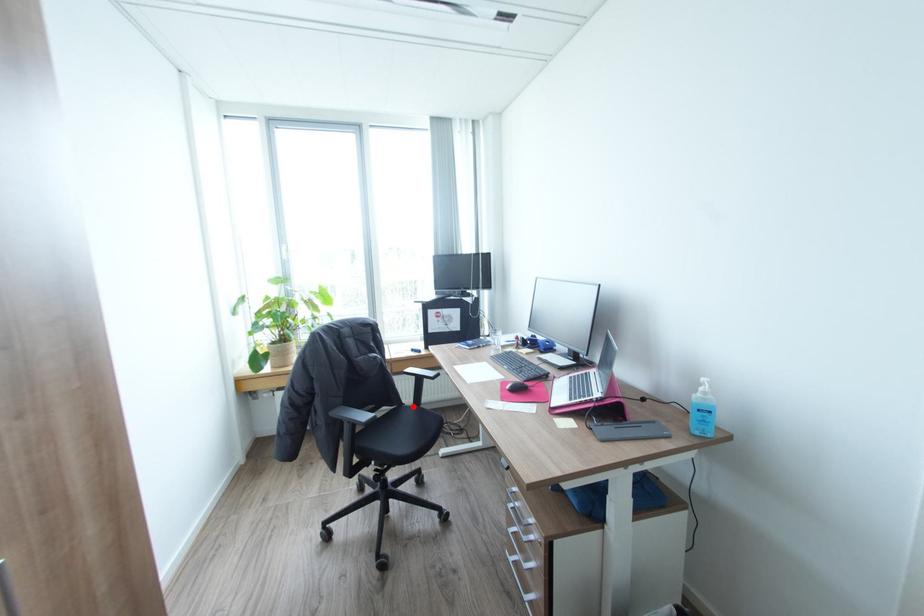
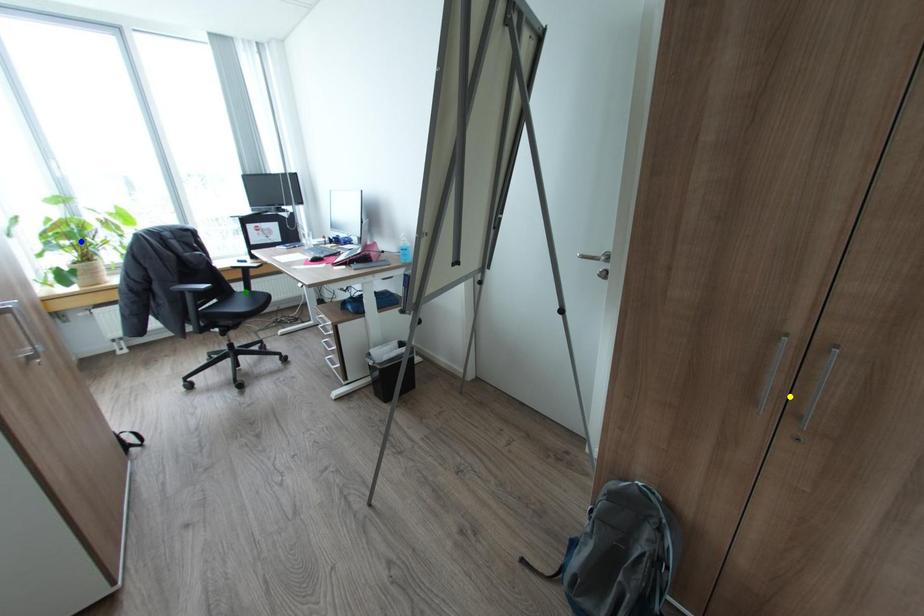
Question: I am providing you with two images of the same scene from different viewpoints. A red point is marked on the first image. You are given multiple points on the second image. Which spot in image 2 lines up with the point in image 1?

Choices:
 (A) yellow point
 (B) blue point
 (C) green point

Answer: (C)